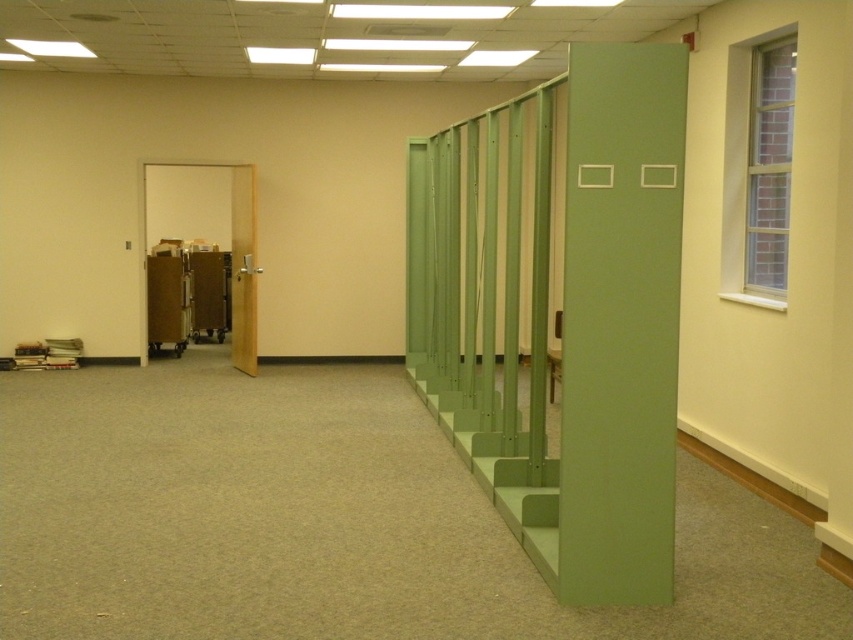
You are moving a large box that is 0.5 meters thick. You need to pass through the doorway in the image. Can the box fit through the doorway if you place it vertically next to the green matte locker at right and the matte wood door at left?

The green matte locker at right is thinner than the matte wood door at left. Since the box is 0.5 meters thick and the locker is thinner than the door, the space between them may accommodate the box. However, without knowing the exact dimensions of the doorway opening, it is uncertain if the box will fit. Please check the doorway width before attempting to move the box.

You are moving a large box that is 1.5 meters wide. You need to pass through the doorway to the other room. Can the green matte locker at right and the matte wood door at left accommodate the box? Explain based on their sizes.

The green matte locker at right is smaller than the matte wood door at left. Since the door is larger, the box that is 1.5 meters wide may fit through the doorway if the door width is sufficient. However, the locker size is not directly related to the doorway passage. Check the door width specifically.

You are standing in the hallway and want to walk from point A to point B. Point A is at coordinate (x=680, y=204) and point B is at coordinate (x=236, y=220). Which point is closer to you when you start?

Point A at coordinate (x=680, y=204) is closer to you than point B at coordinate (x=236, y=220) because the description states that point A is closer to the camera.